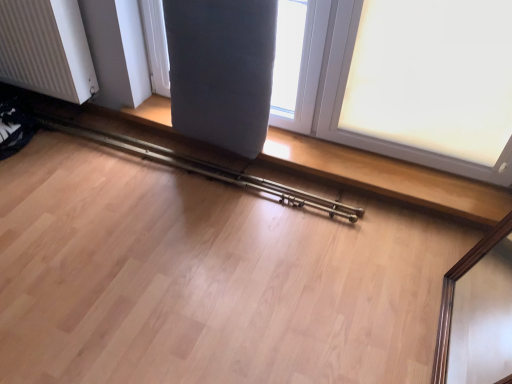
Question: In which direction should I rotate to look at matte gray cushion at upper center, the second window positioned from the right?

Choices:
 (A) left
 (B) right

Answer: (A)

Question: Is white ribbed radiator at left at the left side of metallic brass rail at lower center?

Choices:
 (A) yes
 (B) no

Answer: (A)

Question: Is white ribbed radiator at left aimed at metallic brass rail at lower center?

Choices:
 (A) no
 (B) yes

Answer: (A)

Question: Considering the relative sizes of white ribbed radiator at left and metallic brass rail at lower center in the image provided, is white ribbed radiator at left taller than metallic brass rail at lower center?

Choices:
 (A) no
 (B) yes

Answer: (B)

Question: Is white ribbed radiator at left further to the viewer compared to metallic brass rail at lower center?

Choices:
 (A) yes
 (B) no

Answer: (B)

Question: Is white ribbed radiator at left closer to camera compared to metallic brass rail at lower center?

Choices:
 (A) no
 (B) yes

Answer: (B)

Question: Can you confirm if white ribbed radiator at left is positioned to the right of metallic brass rail at lower center?

Choices:
 (A) yes
 (B) no

Answer: (B)

Question: From the image's perspective, does metallic brass rail at lower center appear higher than white frosted glass at upper right, positioned as the 2th window in left-to-right order?

Choices:
 (A) yes
 (B) no

Answer: (B)

Question: Considering the relative sizes of metallic brass rail at lower center and white frosted glass at upper right, positioned as the 2th window in left-to-right order, in the image provided, is metallic brass rail at lower center shorter than white frosted glass at upper right, positioned as the 2th window in left-to-right order,?

Choices:
 (A) no
 (B) yes

Answer: (B)

Question: Does metallic brass rail at lower center have a larger size compared to white frosted glass at upper right, positioned as the 2th window in left-to-right order?

Choices:
 (A) no
 (B) yes

Answer: (A)

Question: Is metallic brass rail at lower center facing away from white frosted glass at upper right, marked as the 1th window in a right-to-left arrangement?

Choices:
 (A) yes
 (B) no

Answer: (B)

Question: From a real-world perspective, is metallic brass rail at lower center physically below white frosted glass at upper right, positioned as the 2th window in left-to-right order?

Choices:
 (A) no
 (B) yes

Answer: (B)

Question: Is the position of metallic brass rail at lower center more distant than that of white frosted glass at upper right, positioned as the 2th window in left-to-right order?

Choices:
 (A) yes
 (B) no

Answer: (A)

Question: From a real-world perspective, is metallic brass rail at lower center physically above matte gray cushion at upper center, which is the 1th window from left to right?

Choices:
 (A) yes
 (B) no

Answer: (B)